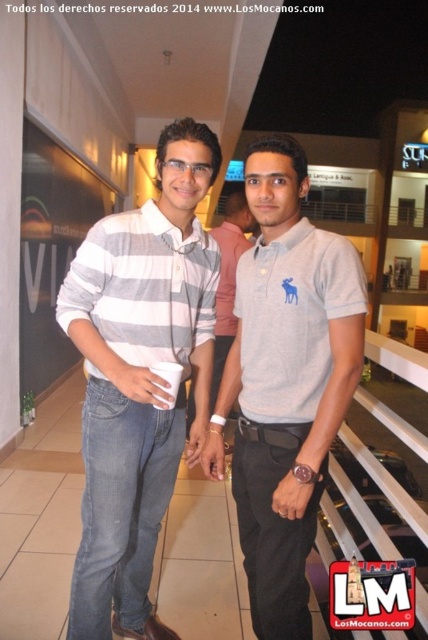
You are at a crowded indoor event and need to locate two people wearing gray polo shirts. According to the scene, which of the two, the gray cotton polo shirt at center or the gray striped polo shirt at center, is closer to you?

The gray cotton polo shirt at center is closer to you because it is positioned in front of the gray striped polo shirt at center.

You are a photographer at the event and need to adjust the lighting so that both the gray cotton polo shirt at center and the gray striped polo shirt at center are equally visible. Given their height difference, which one might require more upward or downward adjustment of the camera angle?

The gray cotton polo shirt at center is shorter than the gray striped polo shirt at center. To make both equally visible, the camera angle should be adjusted downward for the taller gray striped polo shirt at center or upward for the shorter gray cotton polo shirt at center.

Consider the image. You are a photographer trying to capture a clear shot of both the gray striped polo shirt at left and the gray cotton polo shirt at center. Since you want both shirts to be visible in the frame, which one should you focus on first to ensure the other is also in focus?

The gray striped polo shirt at left is positioned under the gray cotton polo shirt at center. To ensure both are in focus, you should focus on the gray cotton polo shirt at center first, as it is closer to the camera, allowing the gray striped polo shirt at left to remain in the depth of field.